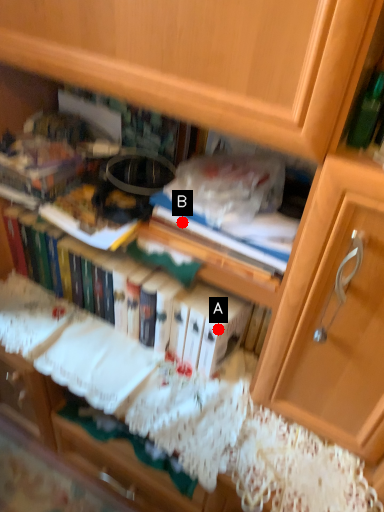
Question: Two points are circled on the image, labeled by A and B beside each circle. Which point appears closest to the camera in this image?

Choices:
 (A) A is closer
 (B) B is closer

Answer: (B)